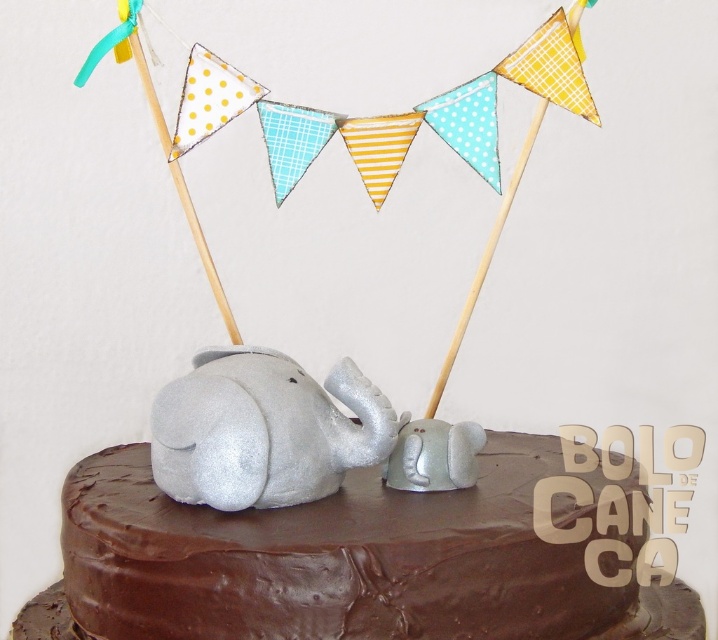
Where is the chocolate matte elephant at center located in the image?

The chocolate matte elephant at center is located at point (349,556) in the image.

You are a photographer standing at a certain distance from the chocolate matte elephant at center. You want to take a closeup shot of it. Given that your camera requires a minimum distance of 30 inches to focus properly, will you need to move closer or farther away?

The chocolate matte elephant at center is 33.97 inches away from the camera, which is beyond the minimum focusing distance of 30 inches. Therefore, you do not need to move closer. You can take the closeup shot from your current position.

You are a guest at a birthday party and see the cake with the chocolate matte elephant at center and the silver glitter baby elephant at center. From the perspective of someone standing in front of the cake, which elephant is positioned to the left?

The silver glitter baby elephant at center is positioned to the left of the chocolate matte elephant at center.